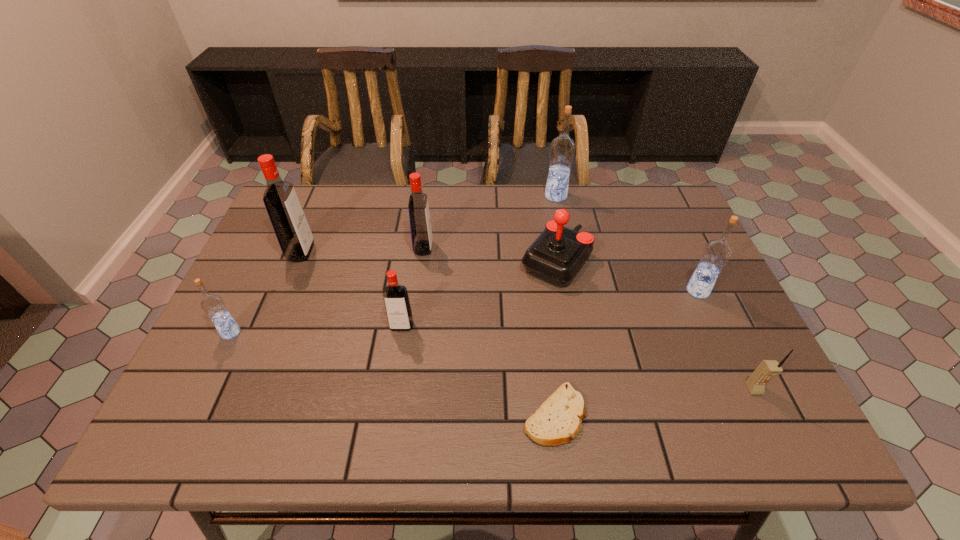
Where is `the smallest blue vodka`? This screenshot has height=540, width=960. the smallest blue vodka is located at coordinates (213, 305).

Image resolution: width=960 pixels, height=540 pixels. Identify the location of the second shortest object. (766, 369).

I want to click on the shortest object, so click(x=558, y=420).

The image size is (960, 540). I want to click on blank area located on the right of the second vodka from right to left, so click(623, 196).

Locate an element on the screen. free space located 0.150m on the front and back of the leftmost red vodka is located at coordinates (366, 252).

The image size is (960, 540). Identify the location of vacant region located on the front and back of the second smallest red vodka. (573, 248).

Where is `vacant space located on the front of the second smallest blue vodka`? This screenshot has width=960, height=540. vacant space located on the front of the second smallest blue vodka is located at coordinates (761, 428).

The width and height of the screenshot is (960, 540). I want to click on free space located on the right of the red joystick, so click(668, 261).

I want to click on vacant area situated 0.100m on the front and back of the smallest red vodka, so click(x=396, y=369).

Where is `vacant area situated on the right of the leftmost blue vodka`? vacant area situated on the right of the leftmost blue vodka is located at coordinates (337, 333).